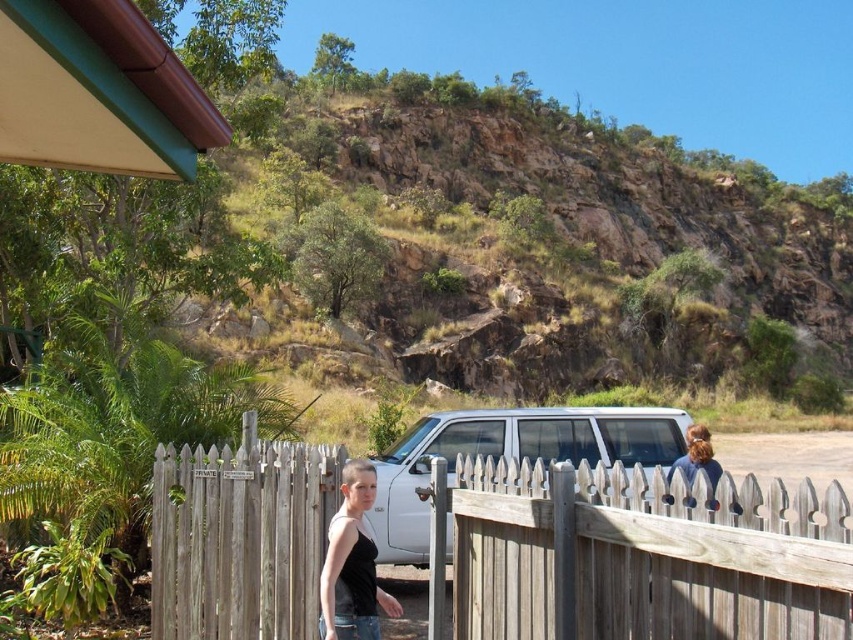
Question: Can you confirm if wooden picket fence at center is positioned above white matte suv at center?

Choices:
 (A) no
 (B) yes

Answer: (B)

Question: Does wooden picket fence at center appear under black matte tank top at center?

Choices:
 (A) yes
 (B) no

Answer: (B)

Question: Where is white matte suv at center located in relation to black matte tank top at center in the image?

Choices:
 (A) right
 (B) left

Answer: (A)

Question: Which point appears farthest from the camera in this image?

Choices:
 (A) (502, 451)
 (B) (592, 550)

Answer: (A)

Question: Which object is positioned farthest from the wooden picket fence at center?

Choices:
 (A) dark brown hair at upper right
 (B) white matte suv at center

Answer: (B)

Question: Which object appears closest to the camera in this image?

Choices:
 (A) wooden picket fence at center
 (B) white matte suv at center
 (C) dark brown hair at upper right
 (D) black matte tank top at center

Answer: (A)